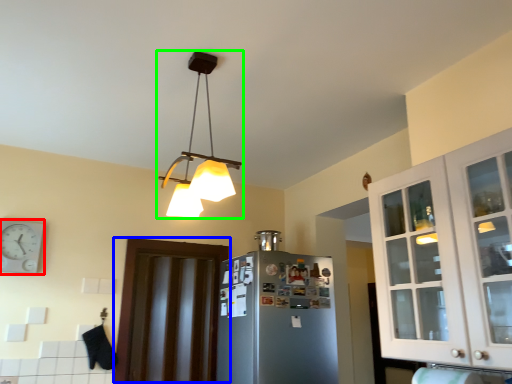
Question: Based on their relative distances, which object is nearer to clock (highlighted by a red box)? Choose from door (highlighted by a blue box) and lamp (highlighted by a green box).

Choices:
 (A) door
 (B) lamp

Answer: (A)